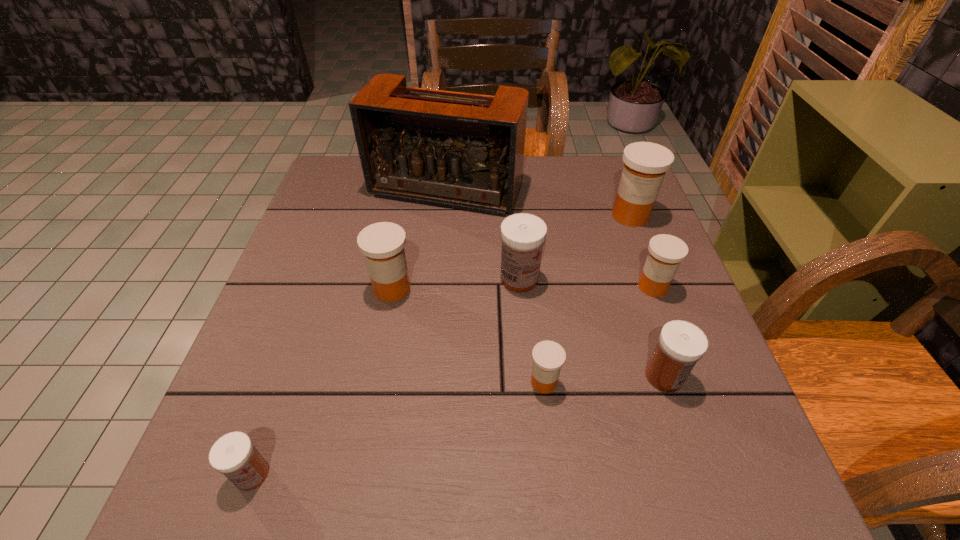
Image resolution: width=960 pixels, height=540 pixels. I want to click on vacant area that lies between the smallest orange medicine and the second farthest white medicine, so click(604, 379).

The height and width of the screenshot is (540, 960). Identify the location of vacant point located between the farthest orange medicine and the nearest orange medicine. (588, 299).

This screenshot has width=960, height=540. I want to click on vacant area that lies between the second smallest orange medicine and the second biggest white medicine, so click(x=659, y=332).

This screenshot has width=960, height=540. I want to click on vacant point located between the second smallest orange medicine and the leftmost object, so click(452, 380).

Identify the location of vacant region between the second farthest white medicine and the third biggest orange medicine. (659, 332).

Find the location of `vacant space in between the second smallest orange medicine and the nearest object`. vacant space in between the second smallest orange medicine and the nearest object is located at coordinates (452, 380).

Find the location of `free space that is in between the second smallest orange medicine and the tallest medicine`. free space that is in between the second smallest orange medicine and the tallest medicine is located at coordinates (641, 251).

Identify the location of free space between the radio receiver and the farthest medicine. Image resolution: width=960 pixels, height=540 pixels. (539, 202).

Locate an element on the screen. This screenshot has width=960, height=540. the seventh closest object relative to the radio receiver is located at coordinates (234, 455).

Find the location of `object that ranks as the seventh closest to the farthest white medicine`. object that ranks as the seventh closest to the farthest white medicine is located at coordinates (234, 455).